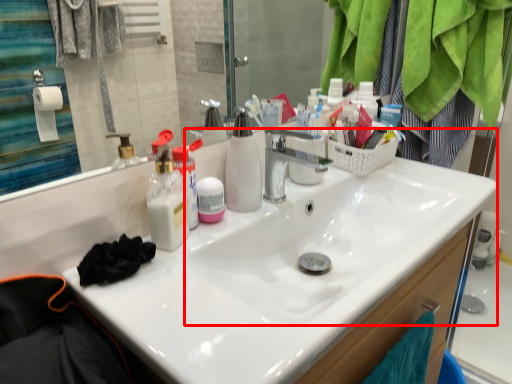
Question: From the image's perspective, where is sink (annotated by the red box) located in relation to toiletries in the image?

Choices:
 (A) below
 (B) above

Answer: (A)